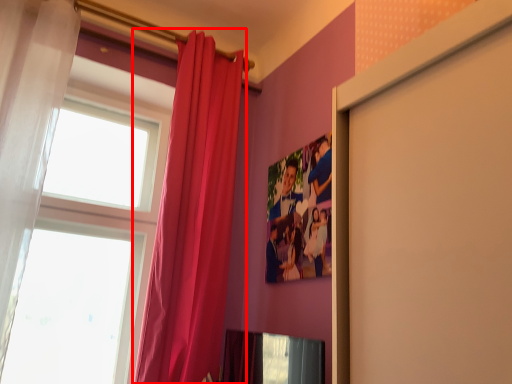
Question: From the image's perspective, where is curtain (annotated by the red box) located in relation to curtain in the image?

Choices:
 (A) below
 (B) above

Answer: (A)